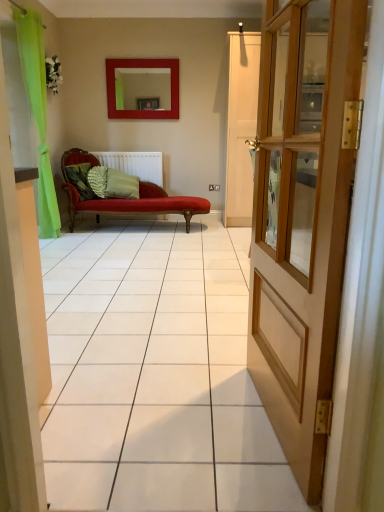
Question: Looking at the image, does matte red mirror at upper center seem bigger or smaller compared to camouflage fabric pillow at center, which appears as the third pillow when viewed from the right?

Choices:
 (A) small
 (B) big

Answer: (B)

Question: Considering their positions, is matte red mirror at upper center located in front of or behind camouflage fabric pillow at center, the 1th pillow from the left?

Choices:
 (A) front
 (B) behind

Answer: (B)

Question: Estimate the real-world distances between objects in this image. Which object is farther from the green fabric pillow at center, the first pillow in the right-to-left sequence?

Choices:
 (A) wooden door at right
 (B) green textured pillow at center, the second pillow in the right-to-left sequence
 (C) camouflage fabric pillow at center, which appears as the third pillow when viewed from the right
 (D) matte red mirror at upper center
 (E) white matte radiator at center

Answer: (A)

Question: Which of these objects is positioned closest to the green fabric pillow at center, positioned as the 3th pillow in left-to-right order?

Choices:
 (A) matte red mirror at upper center
 (B) camouflage fabric pillow at center, which appears as the third pillow when viewed from the right
 (C) white matte radiator at center
 (D) green textured pillow at center, the second pillow in the right-to-left sequence
 (E) wooden door at right

Answer: (D)